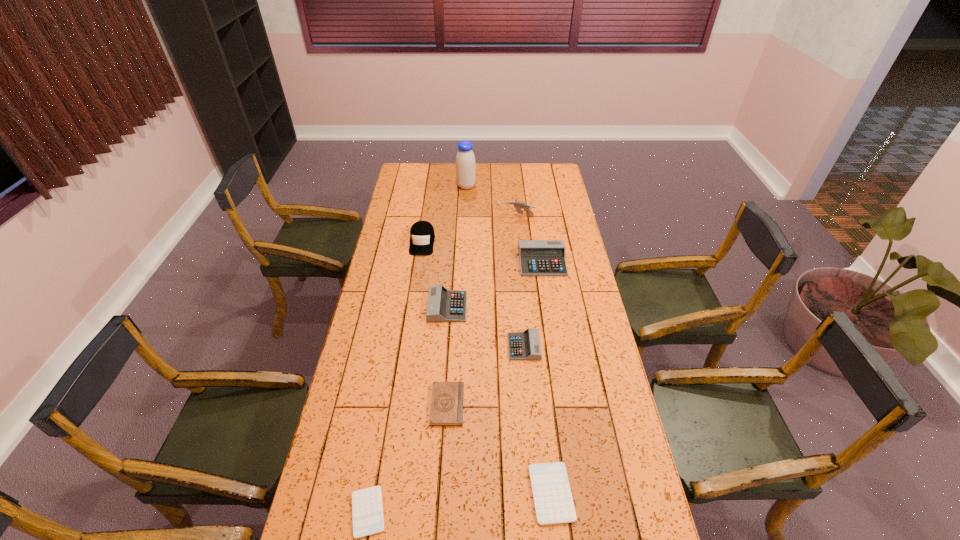
Locate an element on the screen. free space between the sixth tallest object and the gun is located at coordinates (519, 282).

Locate an element on the screen. free spot between the left white calculator and the eighth nearest object is located at coordinates tap(442, 364).

Find the location of a particular element. free space between the farthest gray calculator and the cap is located at coordinates (482, 252).

You are a GUI agent. You are given a task and a screenshot of the screen. Output one action in this format:
    pyautogui.click(x=<x>, y=<y>)
    Task: Click on the closest object to the diary
    The width and height of the screenshot is (960, 540).
    Given the screenshot: What is the action you would take?
    pyautogui.click(x=525, y=345)

Choose which object is the second nearest neighbor to the farthest object. Please provide its 2D coordinates. Your answer should be formatted as a tuple, i.e. [(x, y)], where the tuple contains the x and y coordinates of a point satisfying the conditions above.

[(422, 236)]

This screenshot has width=960, height=540. I want to click on calculator object that ranks as the second closest to the fourth nearest object, so click(x=537, y=257).

At what (x,y) coordinates should I click in order to perform the action: click on calculator that stands as the second closest to the third nearest object. Please return your answer as a coordinate pair (x, y). The width and height of the screenshot is (960, 540). Looking at the image, I should click on (367, 511).

Identify the location of gray calculator that stands as the closest to the brown diary. This screenshot has height=540, width=960. (525, 345).

Choose which gray calculator is the third nearest neighbor to the brown diary. Please provide its 2D coordinates. Your answer should be formatted as a tuple, i.e. [(x, y)], where the tuple contains the x and y coordinates of a point satisfying the conditions above.

[(537, 257)]

Where is `free location that satisfies the following two spatial constraints: 1. on the spine side of the bigger white calculator; 2. on the left side of the seventh tallest object`? The width and height of the screenshot is (960, 540). free location that satisfies the following two spatial constraints: 1. on the spine side of the bigger white calculator; 2. on the left side of the seventh tallest object is located at coordinates (442, 493).